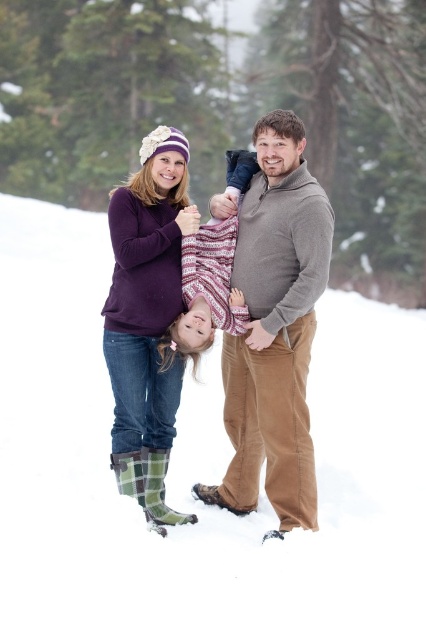
Question: Can you confirm if white fluffy snow at center is thinner than knitted sweater at center?

Choices:
 (A) yes
 (B) no

Answer: (B)

Question: Which point is closer to the camera taking this photo?

Choices:
 (A) (3, 538)
 (B) (147, 468)
 (C) (250, 260)
 (D) (203, 272)

Answer: (A)

Question: Which of the following is the farthest from the observer?

Choices:
 (A) knitted sweater at center
 (B) white fluffy snow at center
 (C) plaid wool boots at lower left
 (D) brown corduroy pants at center

Answer: (A)

Question: Which of the following is the closest to the observer?

Choices:
 (A) knitted sweater at center
 (B) brown corduroy pants at center

Answer: (B)

Question: Where is white fluffy snow at center located in relation to brown corduroy pants at center in the image?

Choices:
 (A) below
 (B) above

Answer: (A)

Question: Can you confirm if white fluffy snow at center is positioned to the right of knitted sweater at center?

Choices:
 (A) yes
 (B) no

Answer: (A)